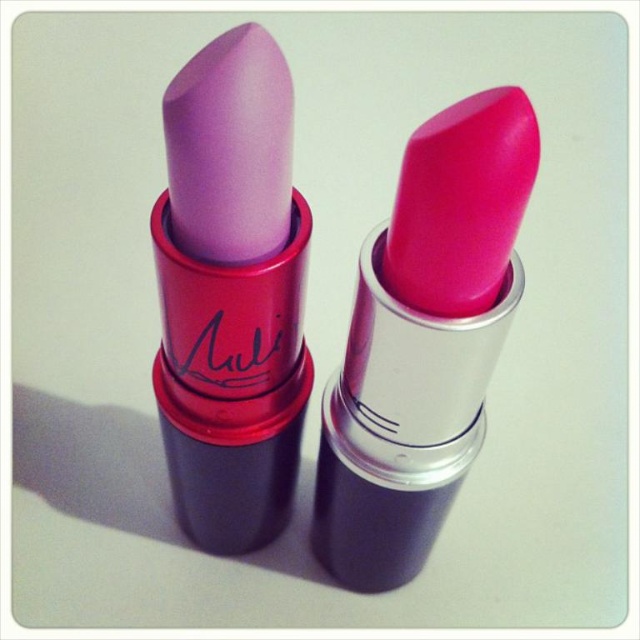
Is matte pink lipstick at center smaller than matte purple lipstick at left?

No.

The image size is (640, 640). Identify the location of matte pink lipstick at center. (422, 340).